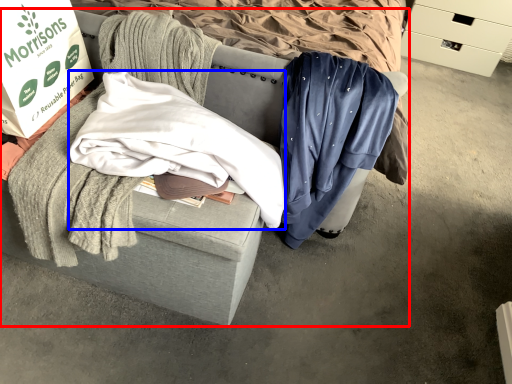
Question: Which point is closer to the camera, furniture (highlighted by a red box) or clothing (highlighted by a blue box)?

Choices:
 (A) furniture
 (B) clothing

Answer: (A)